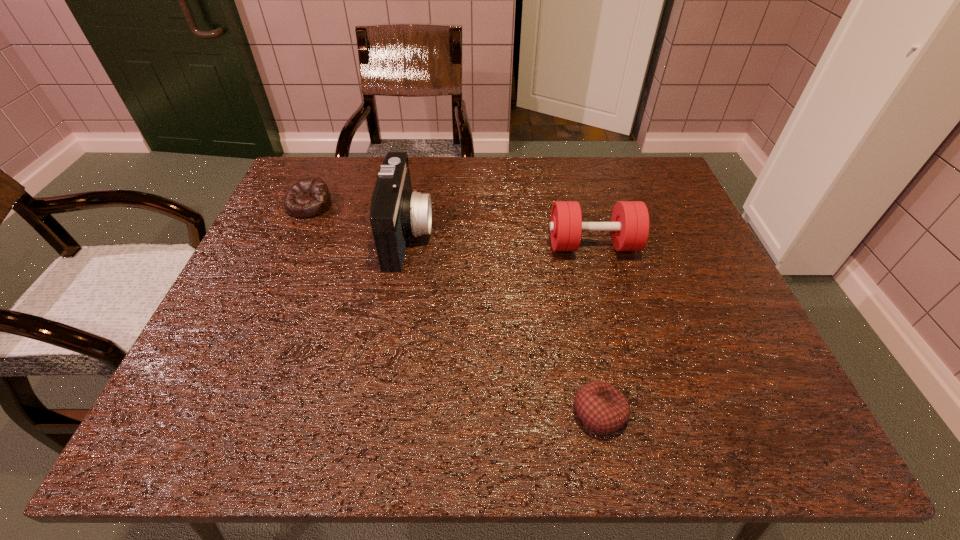
This screenshot has height=540, width=960. In order to click on free location that satisfies the following two spatial constraints: 1. on the lens of the camcorder; 2. on the right side of the nearer beanbag in this screenshot , I will do `click(377, 413)`.

Where is `free location that satisfies the following two spatial constraints: 1. on the lens of the camcorder; 2. on the left side of the dumbbell`? free location that satisfies the following two spatial constraints: 1. on the lens of the camcorder; 2. on the left side of the dumbbell is located at coordinates (406, 245).

Identify the location of free space that satisfies the following two spatial constraints: 1. on the lens of the camcorder; 2. on the left side of the nearest object. (377, 413).

This screenshot has width=960, height=540. Find the location of `vacant point that satisfies the following two spatial constraints: 1. on the lens of the second object from left to right; 2. on the left side of the right beanbag`. vacant point that satisfies the following two spatial constraints: 1. on the lens of the second object from left to right; 2. on the left side of the right beanbag is located at coordinates (377, 413).